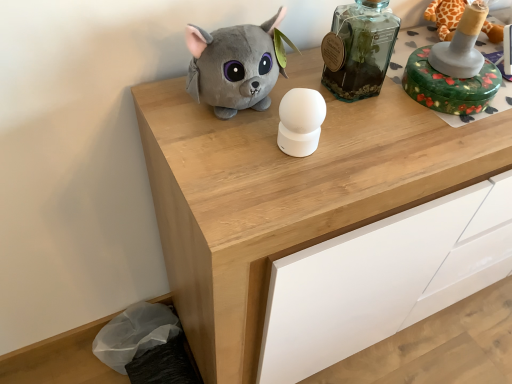
Describe the element at coordinates (359, 49) in the screenshot. I see `transparent glass bottle at upper center` at that location.

Measure the distance between soft plush cat at upper center, which is the 1th toy in left-to-right order, and camera.

soft plush cat at upper center, which is the 1th toy in left-to-right order, is 26.49 inches from camera.

What do you see at coordinates (449, 292) in the screenshot? I see `wooden chest of drawers at center` at bounding box center [449, 292].

Find the location of `transparent glass bottle at upper center`. transparent glass bottle at upper center is located at coordinates (359, 49).

Could you tell me if green floral-patterned box at upper right, which is counted as the second toy, starting from the left, is turned towards transparent glass bottle at upper center?

No.

Is green floral-patterned box at upper right, which is counted as the second toy, starting from the left, spatially inside transparent glass bottle at upper center, or outside of it?

The correct answer is: outside.

Does point (461, 115) come farther from viewer compared to point (335, 38)?

Yes, point (461, 115) is behind point (335, 38).

Looking at this image, from the image's perspective, between wooden chest of drawers at center and green floral-patterned box at upper right, the 1th toy when ordered from right to left, who is located below?

From the image's view, wooden chest of drawers at center is below.

Does wooden chest of drawers at center touch green floral-patterned box at upper right, which is counted as the second toy, starting from the left?

No, wooden chest of drawers at center is not in contact with green floral-patterned box at upper right, which is counted as the second toy, starting from the left.

From a real-world perspective, is wooden chest of drawers at center located higher than green floral-patterned box at upper right, which is counted as the second toy, starting from the left?

No.

Does soft plush cat at upper center, positioned as the 2th toy in right-to-left order, have a lesser height compared to transparent glass bottle at upper center?

Yes, soft plush cat at upper center, positioned as the 2th toy in right-to-left order, is shorter than transparent glass bottle at upper center.

Considering the sizes of objects soft plush cat at upper center, positioned as the 2th toy in right-to-left order, and transparent glass bottle at upper center in the image provided, who is wider, soft plush cat at upper center, positioned as the 2th toy in right-to-left order, or transparent glass bottle at upper center?

Wider between the two is soft plush cat at upper center, positioned as the 2th toy in right-to-left order.

Considering the relative sizes of soft plush cat at upper center, which is the 1th toy in left-to-right order, and transparent glass bottle at upper center in the image provided, is soft plush cat at upper center, which is the 1th toy in left-to-right order, bigger than transparent glass bottle at upper center?

Correct, soft plush cat at upper center, which is the 1th toy in left-to-right order, is larger in size than transparent glass bottle at upper center.

How different are the orientations of soft plush cat at upper center, positioned as the 2th toy in right-to-left order, and transparent glass bottle at upper center in degrees?

The angle between the facing direction of soft plush cat at upper center, positioned as the 2th toy in right-to-left order, and the facing direction of transparent glass bottle at upper center is 1.34 degrees.

Consider the image. Is wooden chest of drawers at center turned away from transparent glass bottle at upper center?

No, transparent glass bottle at upper center is not at the back of wooden chest of drawers at center.

Is wooden chest of drawers at center inside or outside of transparent glass bottle at upper center?

wooden chest of drawers at center is located beyond the bounds of transparent glass bottle at upper center.

Is wooden chest of drawers at center touching transparent glass bottle at upper center?

wooden chest of drawers at center and transparent glass bottle at upper center are not in contact.

Is point (276, 25) more distant than point (426, 72)?

No, it is not.

What's the angular difference between soft plush cat at upper center, positioned as the 2th toy in right-to-left order, and green floral-patterned box at upper right, which is counted as the second toy, starting from the left,'s facing directions?

The facing directions of soft plush cat at upper center, positioned as the 2th toy in right-to-left order, and green floral-patterned box at upper right, which is counted as the second toy, starting from the left, are 1.34 degrees apart.

Is soft plush cat at upper center, which is the 1th toy in left-to-right order, bigger or smaller than green floral-patterned box at upper right, the 1th toy when ordered from right to left?

Considering their sizes, soft plush cat at upper center, which is the 1th toy in left-to-right order, takes up less space than green floral-patterned box at upper right, the 1th toy when ordered from right to left.

Between soft plush cat at upper center, positioned as the 2th toy in right-to-left order, and green floral-patterned box at upper right, the 1th toy when ordered from right to left, which one appears on the left side from the viewer's perspective?

soft plush cat at upper center, positioned as the 2th toy in right-to-left order.

This screenshot has height=384, width=512. What are the coordinates of `toy lying on the left of transparent glass bottle at upper center` in the screenshot? It's located at (234, 66).

Considering their positions, is transparent glass bottle at upper center located in front of or behind soft plush cat at upper center, which is the 1th toy in left-to-right order?

transparent glass bottle at upper center is behind soft plush cat at upper center, which is the 1th toy in left-to-right order.

Is soft plush cat at upper center, positioned as the 2th toy in right-to-left order, located within transparent glass bottle at upper center?

No, soft plush cat at upper center, positioned as the 2th toy in right-to-left order, is located outside of transparent glass bottle at upper center.

Can you confirm if transparent glass bottle at upper center is smaller than soft plush cat at upper center, which is the 1th toy in left-to-right order?

Correct, transparent glass bottle at upper center occupies less space than soft plush cat at upper center, which is the 1th toy in left-to-right order.

Which object is wider, soft plush cat at upper center, positioned as the 2th toy in right-to-left order, or wooden chest of drawers at center?

wooden chest of drawers at center.

Does point (234, 56) appear closer or farther from the camera than point (319, 84)?

Clearly, point (234, 56) is closer to the camera than point (319, 84).

Locate an element on the screen. The image size is (512, 384). the 2nd toy to the left of the wooden chest of drawers at center, starting your count from the anchor is located at coordinates (234, 66).

Looking at this image, from the image's perspective, is soft plush cat at upper center, positioned as the 2th toy in right-to-left order, above or below wooden chest of drawers at center?

Based on their image positions, soft plush cat at upper center, positioned as the 2th toy in right-to-left order, is located above wooden chest of drawers at center.

Where is `bottle that appears above the green floral-patterned box at upper right, which is counted as the second toy, starting from the left (from the image's perspective)`? The image size is (512, 384). bottle that appears above the green floral-patterned box at upper right, which is counted as the second toy, starting from the left (from the image's perspective) is located at coordinates (359, 49).

You are a GUI agent. You are given a task and a screenshot of the screen. Output one action in this format:
    pyautogui.click(x=<x>, y=<y>)
    Task: Click on the chest of drawers that appears in front of the green floral-patterned box at upper right, the 1th toy when ordered from right to left
    
    Given the screenshot: What is the action you would take?
    pyautogui.click(x=449, y=292)

Which object lies nearer to the anchor point soft plush cat at upper center, which is the 1th toy in left-to-right order, wooden chest of drawers at center or transparent glass bottle at upper center?

wooden chest of drawers at center lies closer to soft plush cat at upper center, which is the 1th toy in left-to-right order, than the other object.

From the image, which object appears to be nearer to wooden chest of drawers at center, green floral-patterned box at upper right, the 1th toy when ordered from right to left, or transparent glass bottle at upper center?

Based on the image, transparent glass bottle at upper center appears to be nearer to wooden chest of drawers at center.

Which object lies nearer to the anchor point transparent glass bottle at upper center, green floral-patterned box at upper right, which is counted as the second toy, starting from the left, or wooden chest of drawers at center?

Among the two, green floral-patterned box at upper right, which is counted as the second toy, starting from the left, is located nearer to transparent glass bottle at upper center.

Looking at the image, which one is located further to green floral-patterned box at upper right, the 1th toy when ordered from right to left, wooden chest of drawers at center or soft plush cat at upper center, positioned as the 2th toy in right-to-left order?

soft plush cat at upper center, positioned as the 2th toy in right-to-left order.

Considering their positions, is wooden chest of drawers at center positioned closer to green floral-patterned box at upper right, the 1th toy when ordered from right to left, than transparent glass bottle at upper center?

transparent glass bottle at upper center lies closer to green floral-patterned box at upper right, the 1th toy when ordered from right to left, than the other object.

Which object lies nearer to the anchor point green floral-patterned box at upper right, which is counted as the second toy, starting from the left, transparent glass bottle at upper center or soft plush cat at upper center, positioned as the 2th toy in right-to-left order?

transparent glass bottle at upper center is closer to green floral-patterned box at upper right, which is counted as the second toy, starting from the left.

Considering their positions, is transparent glass bottle at upper center positioned further to soft plush cat at upper center, which is the 1th toy in left-to-right order, than wooden chest of drawers at center?

The object further to soft plush cat at upper center, which is the 1th toy in left-to-right order, is transparent glass bottle at upper center.

Based on their spatial positions, is soft plush cat at upper center, which is the 1th toy in left-to-right order, or wooden chest of drawers at center further from transparent glass bottle at upper center?

soft plush cat at upper center, which is the 1th toy in left-to-right order.

The width and height of the screenshot is (512, 384). In order to click on toy located between transparent glass bottle at upper center and wooden chest of drawers at center in the left-right direction in this screenshot , I will do (454, 70).

Identify the location of toy located between soft plush cat at upper center, which is the 1th toy in left-to-right order, and wooden chest of drawers at center in the left-right direction. The width and height of the screenshot is (512, 384). (454, 70).

Find the location of a particular element. bottle between soft plush cat at upper center, which is the 1th toy in left-to-right order, and wooden chest of drawers at center from left to right is located at coordinates (359, 49).

The width and height of the screenshot is (512, 384). In order to click on bottle between soft plush cat at upper center, which is the 1th toy in left-to-right order, and green floral-patterned box at upper right, the 1th toy when ordered from right to left in this screenshot , I will do `click(359, 49)`.